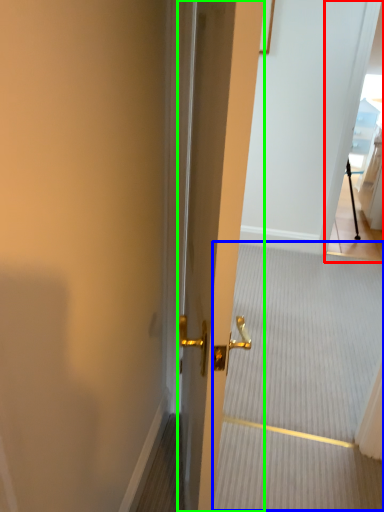
Question: Estimate the real-world distances between objects in this image. Which object is farther from glass door (highlighted by a red box), stair (highlighted by a blue box) or door (highlighted by a green box)?

Choices:
 (A) stair
 (B) door

Answer: (B)